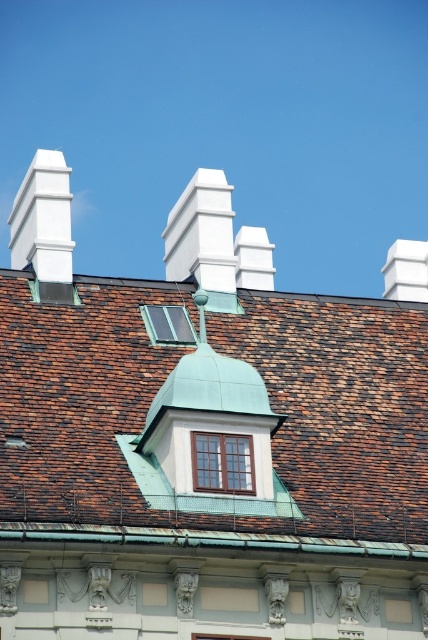
You are a drone operator trying to land a drone on the roof shown in the scene. The drone has a landing pad requirement that it must be placed exactly at coordinate point 0.639, 0.500. Can you confirm if the brown shingles at center are located at this coordinate?

The brown shingles at center are indeed located at coordinate point (214, 408), so the drone can land there.

You are a window installer who needs to replace both the clear glass window at center and the transparent glass window at center. The delivery truck can only make one trip and must carry both windows. What is the minimum distance the truck needs to travel between the two windows to ensure accurate measurements?

The clear glass window at center and transparent glass window at center are 11.28 meters apart from each other, so the truck needs to travel at least 11.28 meters between them to ensure accurate measurements.